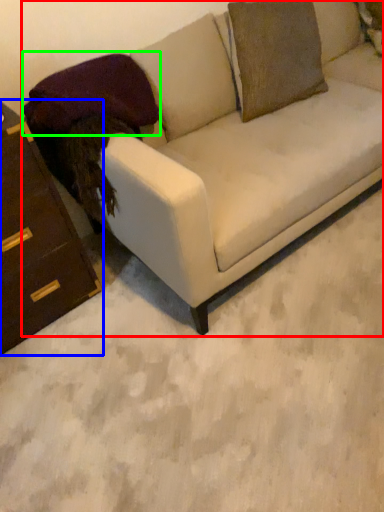
Question: Which object is the farthest from studio couch (highlighted by a red box)? Choose among these: chest of drawers (highlighted by a blue box) or pillow (highlighted by a green box).

Choices:
 (A) chest of drawers
 (B) pillow

Answer: (A)